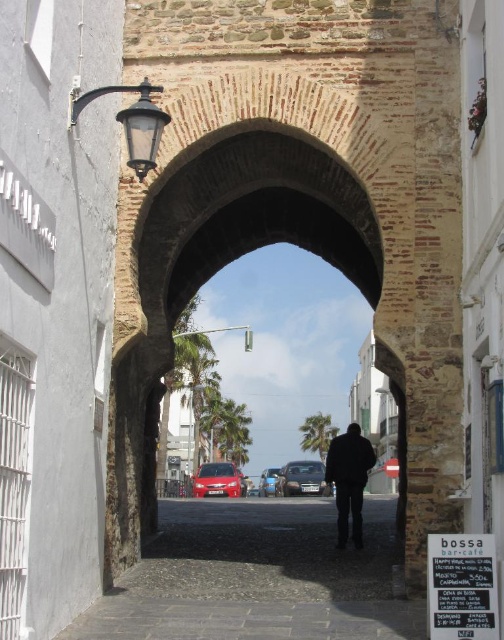
Question: Among these points, which one is farthest from the camera?

Choices:
 (A) (230, 481)
 (B) (289, 493)

Answer: (B)

Question: Can you confirm if shiny red car at center is positioned to the right of metallic blue sedan at center?

Choices:
 (A) no
 (B) yes

Answer: (A)

Question: Can you confirm if dark matte jacket at center is positioned to the left of metallic silver car at center?

Choices:
 (A) no
 (B) yes

Answer: (B)

Question: Can you confirm if dark gray cobblestone alley at center is positioned below metallic silver car at center?

Choices:
 (A) yes
 (B) no

Answer: (B)

Question: Based on their relative distances, which object is farther from the metallic blue sedan at center?

Choices:
 (A) shiny red car at center
 (B) dark matte jacket at center
 (C) dark gray cobblestone alley at center

Answer: (B)

Question: Estimate the real-world distances between objects in this image. Which object is farther from the dark matte jacket at center?

Choices:
 (A) shiny red car at center
 (B) metallic blue sedan at center

Answer: (B)